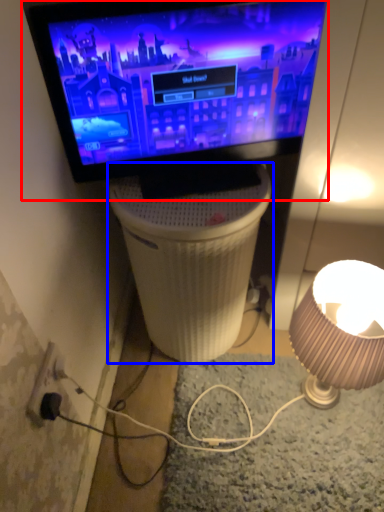
Question: Which point is further to the camera, television (highlighted by a red box) or table (highlighted by a blue box)?

Choices:
 (A) television
 (B) table

Answer: (B)